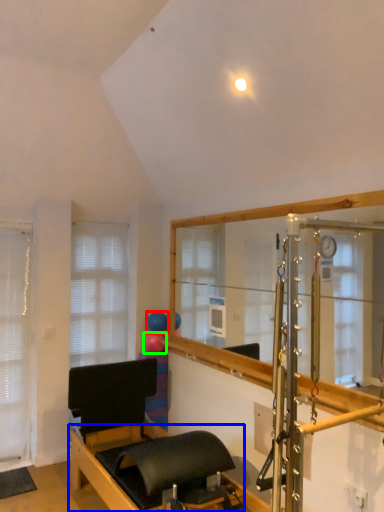
Question: Based on their relative distances, which object is farther from balloon (highlighted by a red box)? Choose from bed frame (highlighted by a blue box) and balloon (highlighted by a green box).

Choices:
 (A) bed frame
 (B) balloon

Answer: (A)